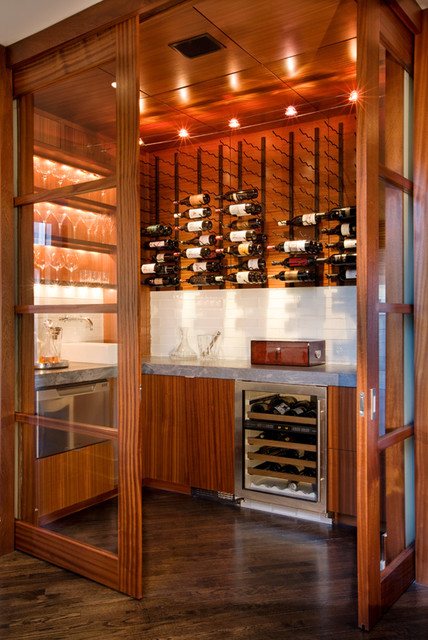
Locate an element on the screen. lights is located at coordinates (287, 111).